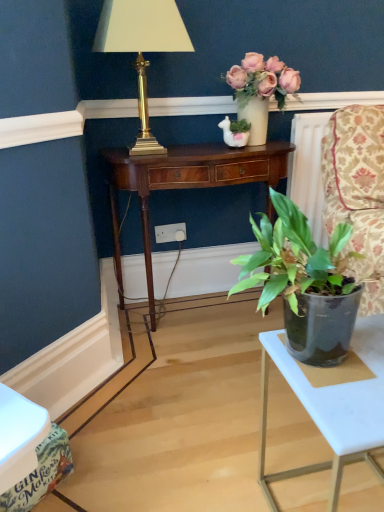
Question: In terms of height, does mahogany wood desk at center look taller or shorter compared to green glossy plant at center, acting as the first houseplant starting from the front?

Choices:
 (A) short
 (B) tall

Answer: (B)

Question: Considering the positions of mahogany wood desk at center and green glossy plant at center, acting as the second houseplant starting from the back, in the image, is mahogany wood desk at center wider or thinner than green glossy plant at center, acting as the second houseplant starting from the back,?

Choices:
 (A) wide
 (B) thin

Answer: (A)

Question: Which is farther from the green glossy leafy plant at center, positioned as the first houseplant in back-to-front order?

Choices:
 (A) mahogany wood desk at center
 (B) green glossy plant at center, acting as the second houseplant starting from the back
 (C) gold metallic lamp at upper left
 (D) white plastic table at lower right
 (E) white plastic power outlet at center

Answer: (D)

Question: Which is farther from the mahogany wood desk at center?

Choices:
 (A) green glossy plant at center, acting as the first houseplant starting from the front
 (B) white plastic power outlet at center
 (C) white plastic table at lower right
 (D) gold metallic lamp at upper left
 (E) green glossy leafy plant at center, positioned as the first houseplant in back-to-front order

Answer: (C)